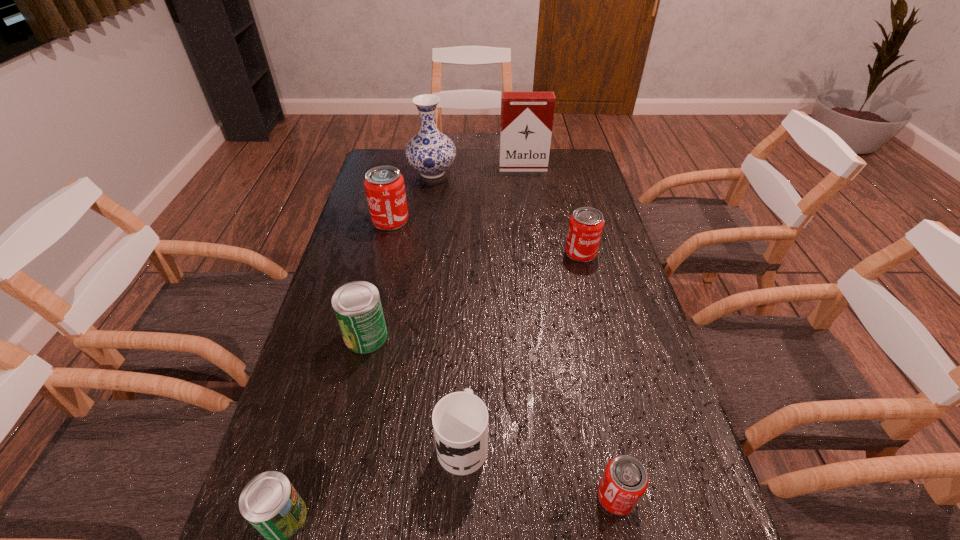
Locate which red can ranks second in proximity to the blue vase. Please provide its 2D coordinates. Your answer should be formatted as a tuple, i.e. [(x, y)], where the tuple contains the x and y coordinates of a point satisfying the conditions above.

[(586, 224)]

Locate an element on the screen. This screenshot has width=960, height=540. red can that is the second closest to the blue vase is located at coordinates (586, 224).

This screenshot has height=540, width=960. What are the coordinates of `free space that satisfies the following two spatial constraints: 1. on the front side of the smallest red can; 2. on the right side of the leftmost red can` in the screenshot? It's located at (324, 496).

Locate an element on the screen. This screenshot has width=960, height=540. vacant position in the image that satisfies the following two spatial constraints: 1. on the front-facing side of the cigarette_case; 2. on the right side of the second biggest red can is located at coordinates (535, 253).